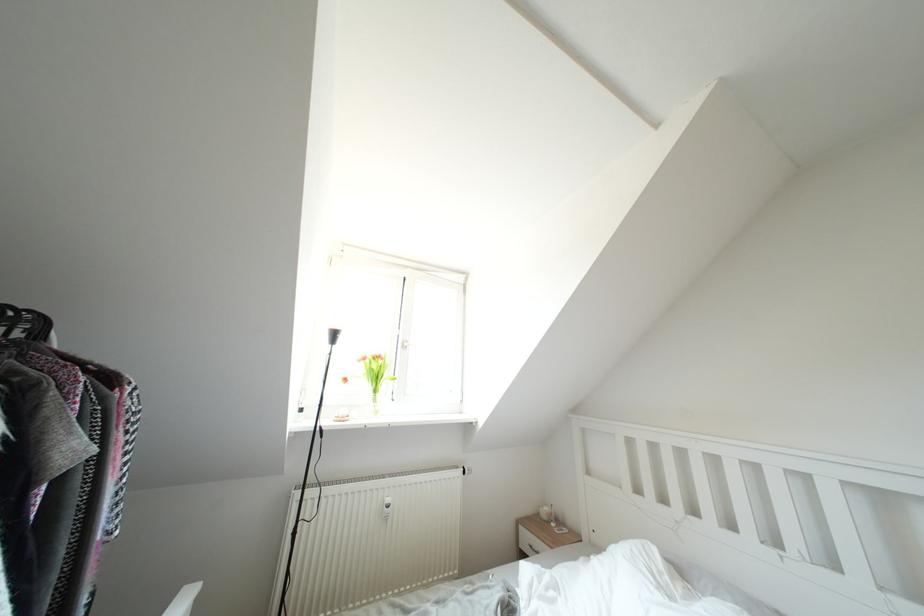
The image size is (924, 616). I want to click on white cylindrical container, so click(546, 513).